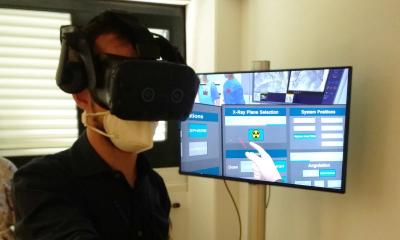
Find the location of a particular element. The height and width of the screenshot is (240, 400). cords from tv is located at coordinates (226, 187), (269, 191).